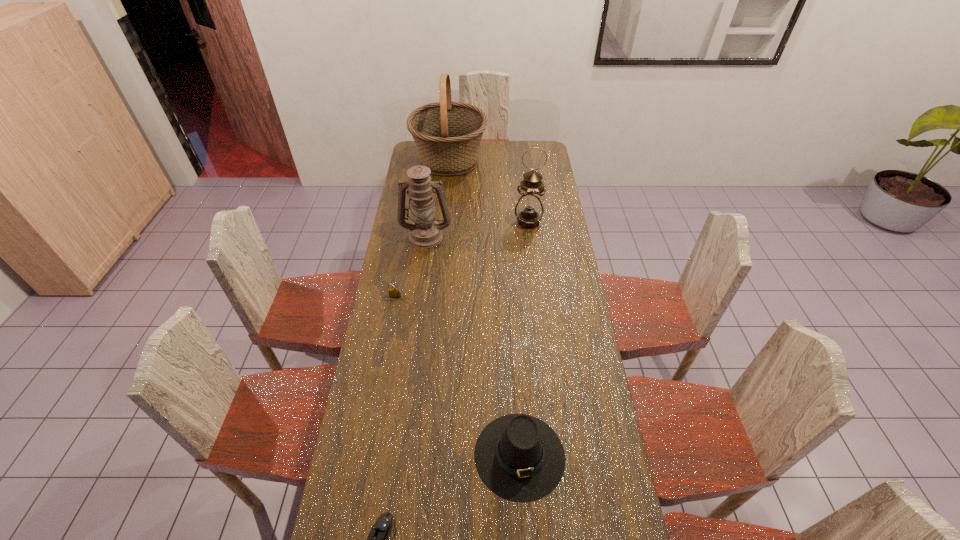
Where is `free space at the far right corner of the desktop`? free space at the far right corner of the desktop is located at coordinates (543, 148).

Find the location of a particular element. free area in between the farthest object and the right oil lamp is located at coordinates (489, 191).

You are a GUI agent. You are given a task and a screenshot of the screen. Output one action in this format:
    pyautogui.click(x=<x>, y=<y>)
    Task: Click on the free spot between the basket and the left oil lamp
    The height and width of the screenshot is (540, 960).
    Given the screenshot: What is the action you would take?
    pyautogui.click(x=438, y=198)

Find the location of a particular element. free point between the hat and the left oil lamp is located at coordinates (473, 346).

Identify the location of free point between the third shortest object and the second shortest object. The image size is (960, 540). (457, 376).

Where is `object that is the closest to the fifth tallest object`? object that is the closest to the fifth tallest object is located at coordinates (425, 232).

You are a GUI agent. You are given a task and a screenshot of the screen. Output one action in this format:
    pyautogui.click(x=<x>, y=<y>)
    Task: Click on the fifth closest object relative to the right oil lamp
    
    Given the screenshot: What is the action you would take?
    pyautogui.click(x=382, y=528)